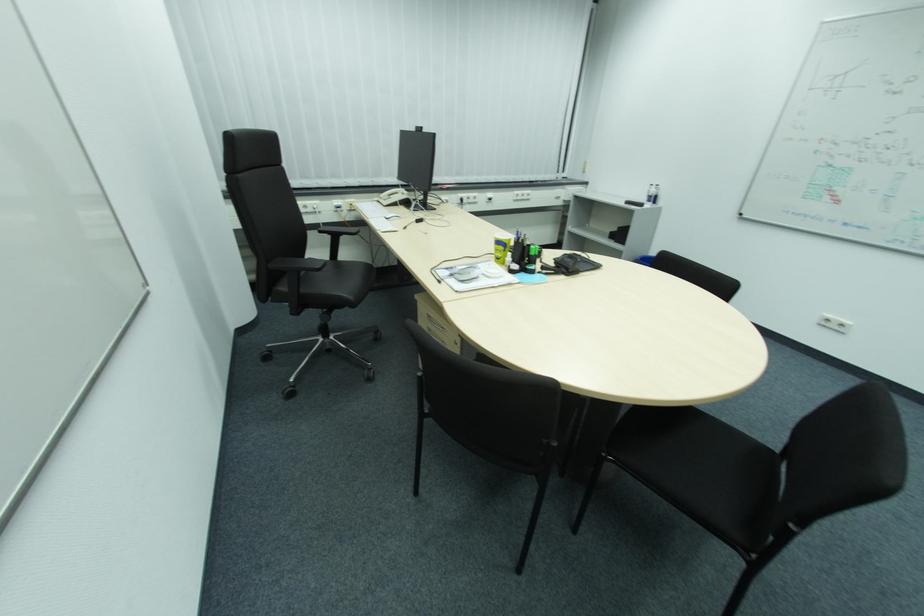
Find where to pull the silver drawer handle. Please return your answer as a coordinate pair (x, y).

(436, 325)